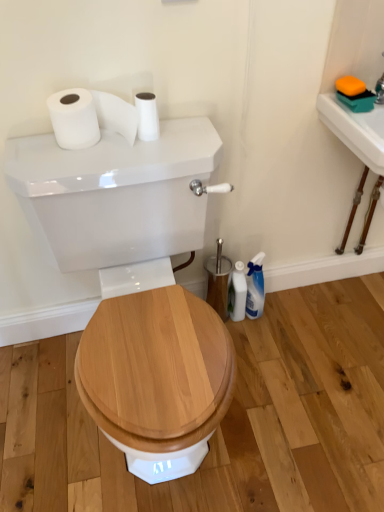
Where is `unoccupied region to the right of white matte toilet paper at upper center, the first toilet paper positioned from the right`? This screenshot has height=512, width=384. unoccupied region to the right of white matte toilet paper at upper center, the first toilet paper positioned from the right is located at coordinates (185, 137).